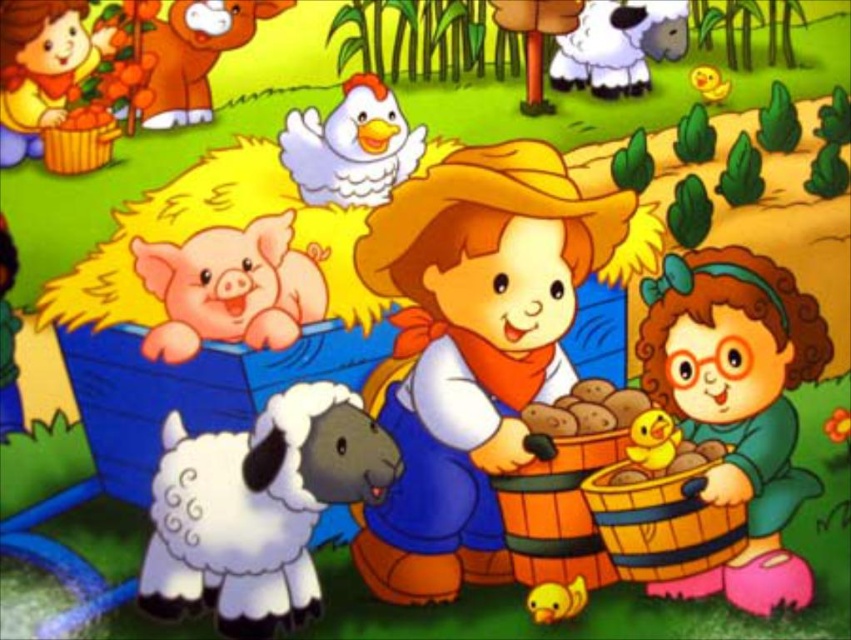
Does point (158, 470) come farther from viewer compared to point (353, 124)?

No.

Can you confirm if white fluffy sheep at lower left is wider than white fluffy chicken at upper center?

Yes, white fluffy sheep at lower left is wider than white fluffy chicken at upper center.

Does point (223, 472) come closer to viewer compared to point (387, 147)?

Yes, it is in front of point (387, 147).

In order to click on white fluffy sheep at lower left in this screenshot , I will do `click(256, 508)`.

Who is more forward, (170, 515) or (585, 76)?

Positioned in front is point (170, 515).

The height and width of the screenshot is (640, 851). In order to click on white fluffy sheep at lower left in this screenshot , I will do `click(256, 508)`.

Where is `white fluffy sheep at lower left`? The image size is (851, 640). white fluffy sheep at lower left is located at coordinates (256, 508).

Between pink rubber pig at left and white fluffy chicken at upper center, which one is positioned lower?

pink rubber pig at left is below.

Is pink rubber pig at left above white fluffy chicken at upper center?

Actually, pink rubber pig at left is below white fluffy chicken at upper center.

Consider the image. Who is more forward, (206,269) or (364,193)?

Point (206,269) is in front.

This screenshot has width=851, height=640. I want to click on pink rubber pig at left, so click(x=231, y=288).